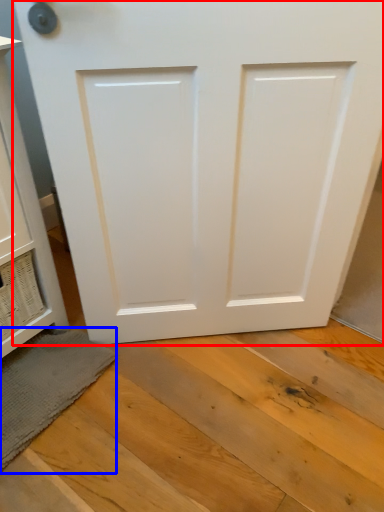
Question: Which point is further to the camera, door (highlighted by a red box) or bath mat (highlighted by a blue box)?

Choices:
 (A) door
 (B) bath mat

Answer: (B)